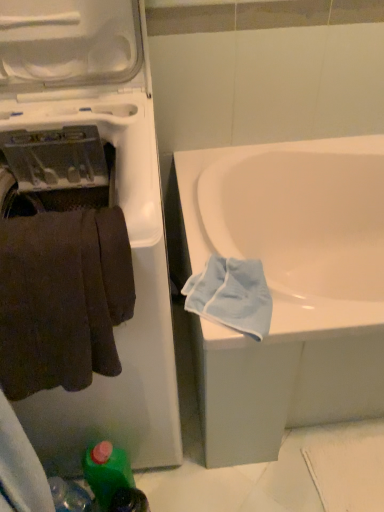
Question: From the image's perspective, is white glossy bathtub at center beneath white plastic washing machine at left?

Choices:
 (A) no
 (B) yes

Answer: (B)

Question: Considering the relative sizes of white glossy bathtub at center and white plastic washing machine at left in the image provided, is white glossy bathtub at center taller than white plastic washing machine at left?

Choices:
 (A) yes
 (B) no

Answer: (B)

Question: Is white plastic washing machine at left a part of white glossy bathtub at center?

Choices:
 (A) yes
 (B) no

Answer: (B)

Question: Is white glossy bathtub at center aimed at white plastic washing machine at left?

Choices:
 (A) no
 (B) yes

Answer: (A)

Question: Can we say white glossy bathtub at center lies outside white plastic washing machine at left?

Choices:
 (A) no
 (B) yes

Answer: (B)

Question: From their relative heights in the image, would you say dark brown fabric towel at left is taller or shorter than white glossy bathtub at center?

Choices:
 (A) short
 (B) tall

Answer: (A)

Question: Would you say dark brown fabric towel at left is inside or outside white glossy bathtub at center?

Choices:
 (A) outside
 (B) inside

Answer: (A)

Question: From a real-world perspective, relative to white glossy bathtub at center, is dark brown fabric towel at left vertically above or below?

Choices:
 (A) below
 (B) above

Answer: (B)

Question: Is dark brown fabric towel at left in front of or behind white glossy bathtub at center in the image?

Choices:
 (A) front
 (B) behind

Answer: (A)

Question: From the image's perspective, is dark brown fabric towel at left located above or below white plastic washing machine at left?

Choices:
 (A) above
 (B) below

Answer: (B)

Question: Considering the positions of dark brown fabric towel at left and white plastic washing machine at left in the image, is dark brown fabric towel at left bigger or smaller than white plastic washing machine at left?

Choices:
 (A) big
 (B) small

Answer: (B)

Question: Is dark brown fabric towel at left taller or shorter than white plastic washing machine at left?

Choices:
 (A) short
 (B) tall

Answer: (A)

Question: Is dark brown fabric towel at left in front of or behind white plastic washing machine at left in the image?

Choices:
 (A) behind
 (B) front

Answer: (A)

Question: Does point (51, 112) appear closer or farther from the camera than point (96, 486)?

Choices:
 (A) farther
 (B) closer

Answer: (B)

Question: Considering the relative positions of white plastic washing machine at left and green plastic bottle at lower left in the image provided, is white plastic washing machine at left to the left or to the right of green plastic bottle at lower left?

Choices:
 (A) left
 (B) right

Answer: (A)